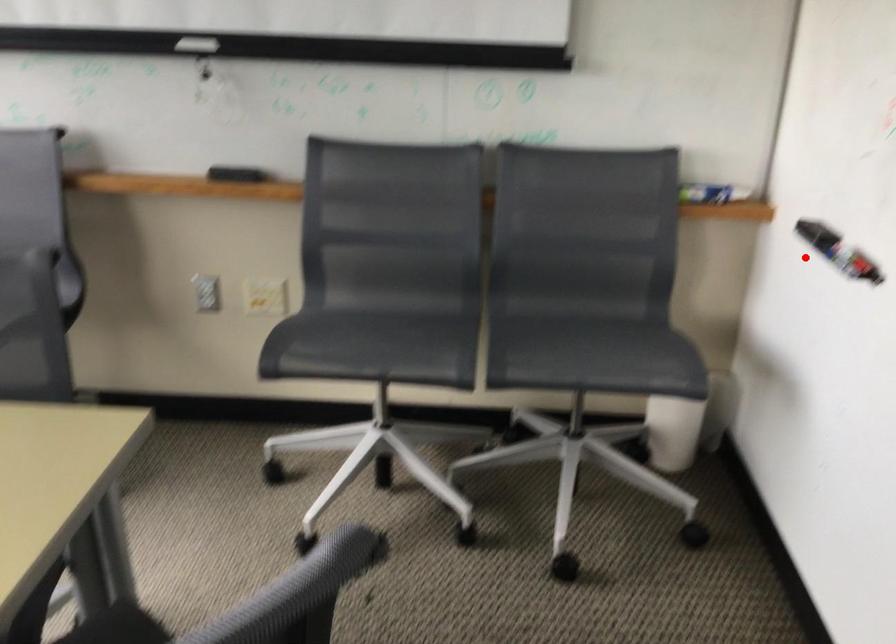
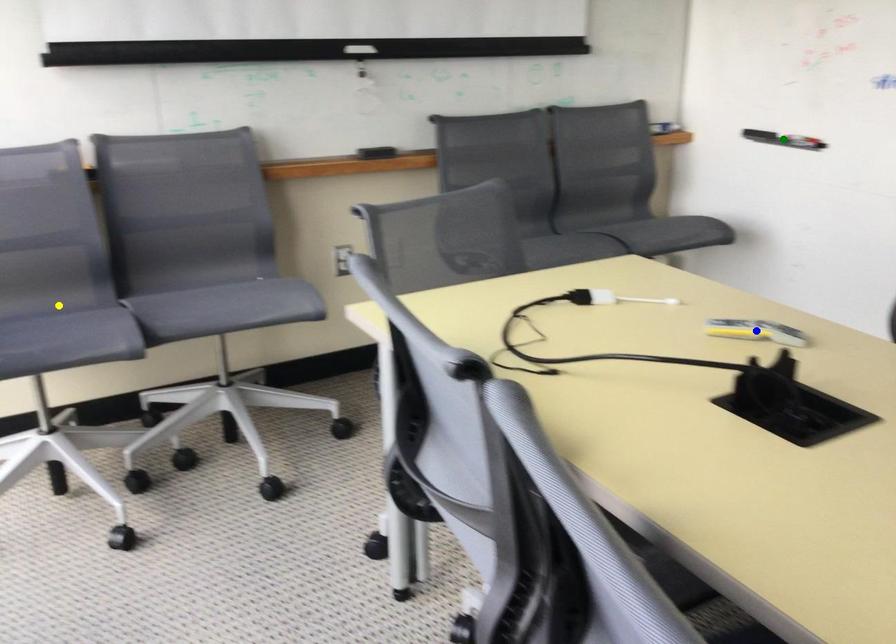
Question: I am providing you with two images of the same scene from different viewpoints. A red point is marked on the first image. You are given multiple points on the second image. Which spot in image 2 lines up with the point in image 1?

Choices:
 (A) green point
 (B) blue point
 (C) yellow point

Answer: (A)